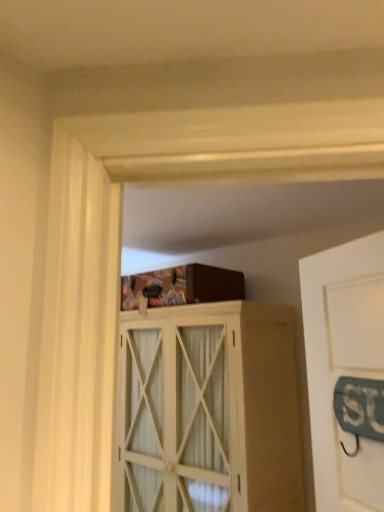
Describe the element at coordinates (209, 409) in the screenshot. I see `white wood cabinet at upper center` at that location.

This screenshot has height=512, width=384. Identify the location of white wood cabinet at upper center. (209, 409).

Identify the location of white wood cabinet at upper center. The image size is (384, 512). (209, 409).